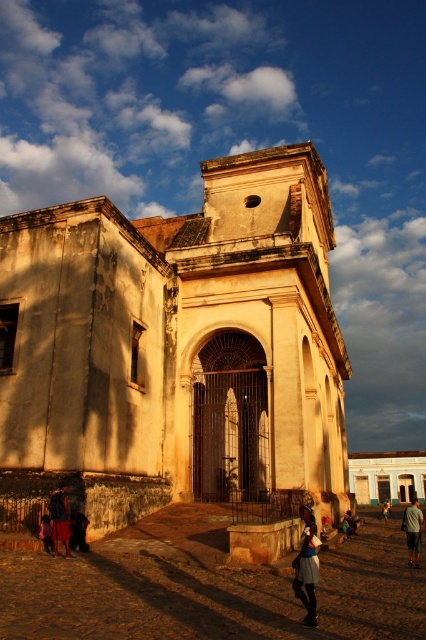
You are a photographer planning to take a group photo of the people at the scene. You want to include both the white smooth church at center and the gray fabric shirt at lower right in the frame. Considering their sizes, which object should you focus on to ensure both are clearly visible?

The white smooth church at center is larger in size than the gray fabric shirt at lower right, so focusing on the church will help ensure both are clearly visible in the photo.

You are a photographer at the scene. You want to capture a photo that includes both the matte blue dress at center and the matte brown skirt at lower left. Based on their positions, which object should you focus on first to ensure both are in frame?

The matte blue dress at center is below the matte brown skirt at lower left, so you should focus on the matte brown skirt at lower left first to ensure both are in frame.

You are a photographer positioned at the entrance of the historic building. You notice two people wearing the matte blue dress at center and the matte brown skirt at lower left. Which clothing item is positioned to the right of the other?

The matte blue dress at center is to the right of the matte brown skirt at lower left according to the description.